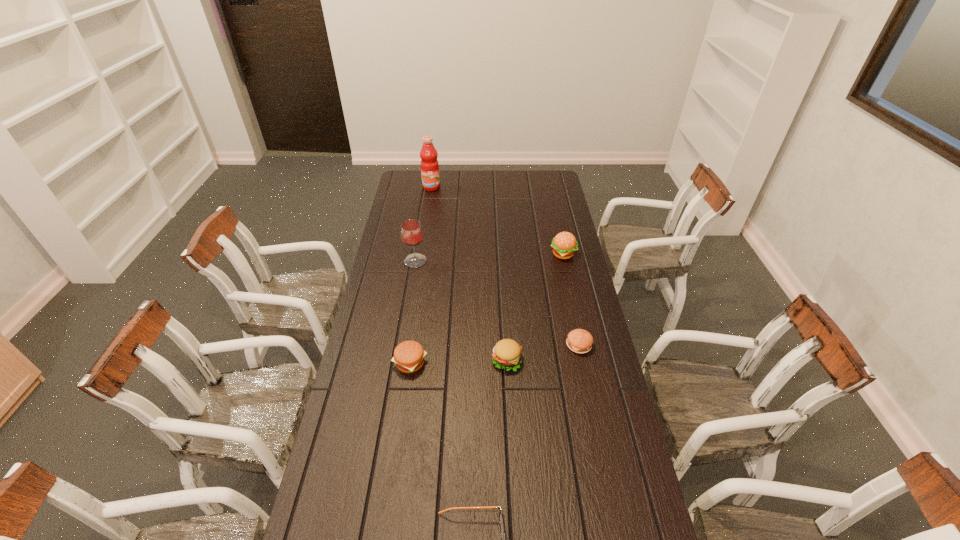
In the image, there is a desktop. Identify the location of vacant space at the left edge. (379, 263).

The width and height of the screenshot is (960, 540). What are the coordinates of `vacant space at the right edge of the desktop` in the screenshot? It's located at (570, 305).

I want to click on unoccupied area between the leftmost hamburger and the farthest hamburger, so click(487, 308).

I want to click on blank region between the third tallest object and the second hamburger from left to right, so click(x=535, y=307).

What are the coordinates of `vacant space that is in between the leftmost hamburger and the second tallest object` in the screenshot? It's located at (413, 312).

Find the location of a particular element. object identified as the closest to the nearest object is located at coordinates [409, 356].

You are a GUI agent. You are given a task and a screenshot of the screen. Output one action in this format:
    pyautogui.click(x=<x>, y=<y>)
    Task: Click on the object that ranks as the fourth closest to the leftmost hamburger
    
    Given the screenshot: What is the action you would take?
    pyautogui.click(x=580, y=341)

I want to click on hamburger identified as the closest to the leftmost hamburger, so click(x=507, y=353).

The image size is (960, 540). I want to click on hamburger that is the fourth nearest to the tallest object, so click(x=580, y=341).

The width and height of the screenshot is (960, 540). In order to click on vacant space that satisfies the following two spatial constraints: 1. on the front label of the tallest hamburger; 2. on the left side of the tallest object in this screenshot , I will do `click(420, 254)`.